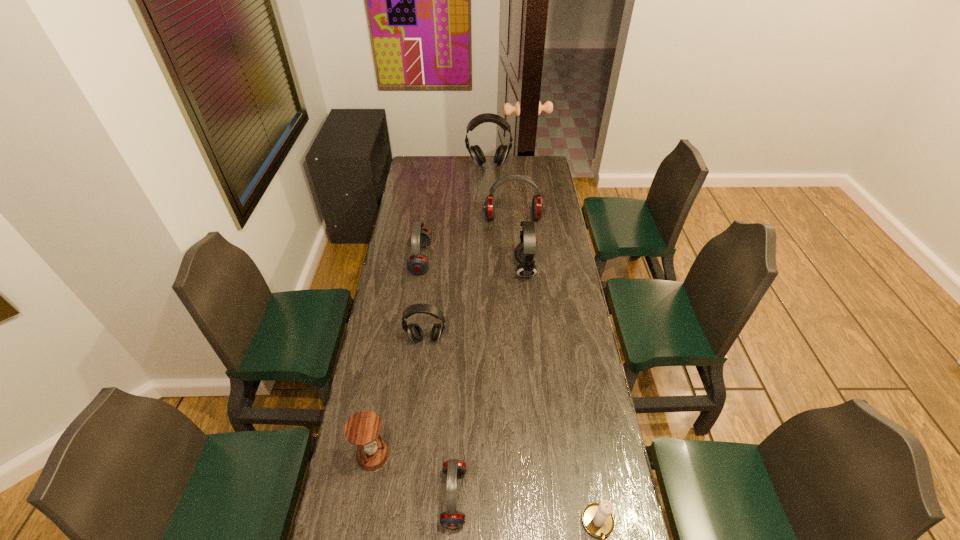
Find the location of a particular element. free space located 0.360m on the ear cups of the shortest earphone is located at coordinates (590, 497).

This screenshot has height=540, width=960. I want to click on object located in the far edge section of the desktop, so click(476, 153).

Locate an element on the screen. hourglass located in the left edge section of the desktop is located at coordinates (362, 429).

At what (x,y) coordinates should I click in order to perform the action: click on object present at the right edge. Please return your answer as a coordinate pair (x, y). Looking at the image, I should click on (538, 207).

In order to click on vacant space at the far edge of the desktop in this screenshot , I will do `click(439, 174)`.

This screenshot has height=540, width=960. In order to click on vacant region at the left edge of the desktop in this screenshot , I will do `click(390, 267)`.

Where is `vacant region at the right edge`? vacant region at the right edge is located at coordinates (550, 336).

In the image, there is a desktop. What are the coordinates of `free space at the far left corner` in the screenshot? It's located at (416, 173).

Where is `free space between the fourth nearest object and the farthest earphone`? Image resolution: width=960 pixels, height=540 pixels. free space between the fourth nearest object and the farthest earphone is located at coordinates (457, 252).

You are a GUI agent. You are given a task and a screenshot of the screen. Output one action in this format:
    pyautogui.click(x=<x>, y=<y>)
    Task: Click on the vacant space that is in between the tallest earphone and the second biggest red earphone
    The width and height of the screenshot is (960, 540).
    Given the screenshot: What is the action you would take?
    pyautogui.click(x=455, y=212)